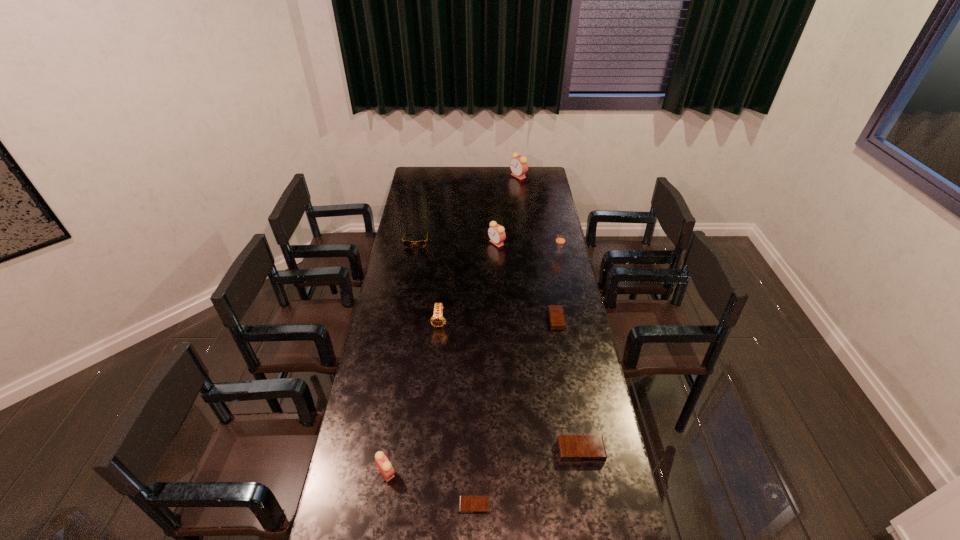
Where is `the tallest alarm clock`? The image size is (960, 540). the tallest alarm clock is located at coordinates (518, 165).

Where is `the farthest alarm clock`? the farthest alarm clock is located at coordinates coord(518,165).

The height and width of the screenshot is (540, 960). What are the coordinates of `straw` in the screenshot? It's located at (560, 240).

This screenshot has width=960, height=540. I want to click on the second farthest pink alarm clock, so click(496, 232).

Find the location of a particular element. The height and width of the screenshot is (540, 960). the fourth alarm clock from right to left is located at coordinates (496, 232).

The image size is (960, 540). Identify the location of black watch. 437,320.

Locate an element on the screen. the seventh object from right to left is located at coordinates (437, 320).

Image resolution: width=960 pixels, height=540 pixels. I want to click on the leftmost alarm clock, so click(x=384, y=466).

You are a GUI agent. You are given a task and a screenshot of the screen. Output one action in this format:
    pyautogui.click(x=<x>, y=<y>)
    Task: Click on the fourth shortest alarm clock
    The height and width of the screenshot is (540, 960).
    Given the screenshot: What is the action you would take?
    pyautogui.click(x=384, y=466)

Image resolution: width=960 pixels, height=540 pixels. What are the coordinates of `the fourth shortest object` in the screenshot? It's located at (421, 243).